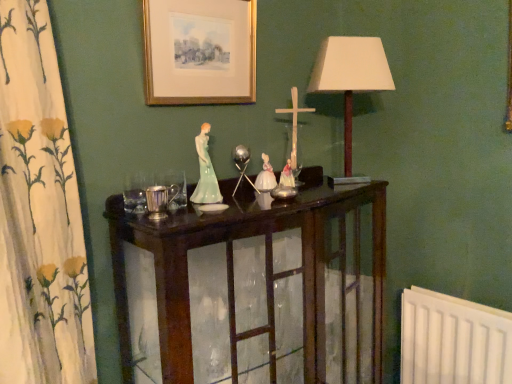
Locate an element on the screen. free spot behind silver metallic candle holder at center is located at coordinates (182, 209).